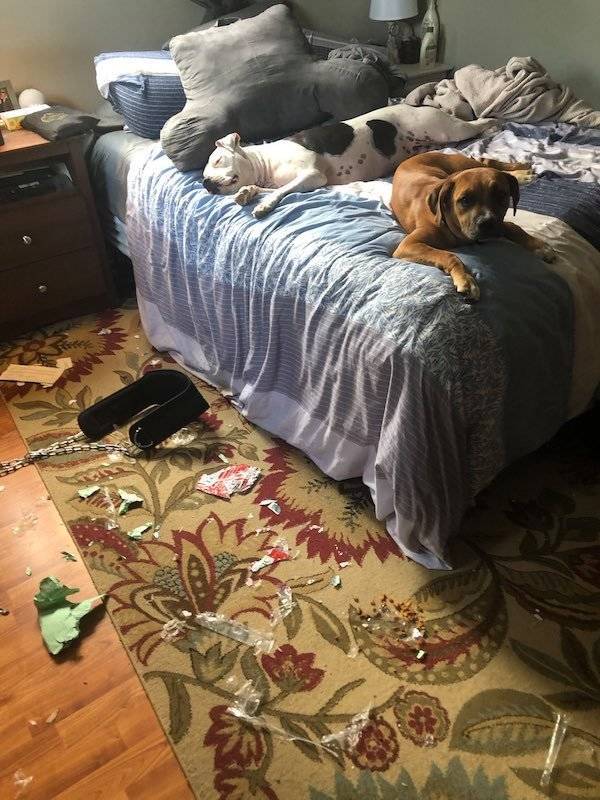
You are a GUI agent. You are given a task and a screenshot of the screen. Output one action in this format:
    pyautogui.click(x=<x>, y=<y>)
    Task: Click on the bed
    The image size is (600, 800).
    Given the screenshot: What is the action you would take?
    pyautogui.click(x=330, y=250)